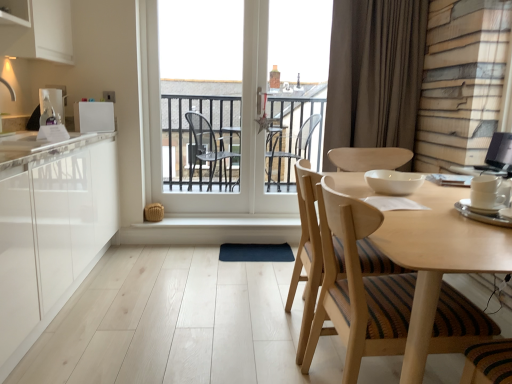
Identify the location of blank space above dark blue rubber mat at center (from a real-world perspective). (256, 246).